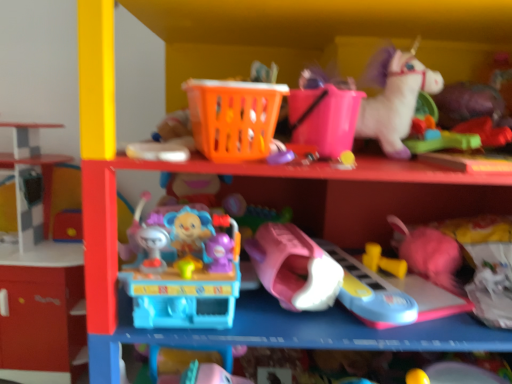
Question: From the image's perspective, is pink plastic toy car at center, placed as the 7th toy when sorted from right to left, located above or below green rubber toy at upper right, which ranks as the 2th toy in right-to-left order?

Choices:
 (A) above
 (B) below

Answer: (B)

Question: From a real-world perspective, is pink plastic toy car at center, the fourth toy in the left-to-right sequence, positioned above or below green rubber toy at upper right, placed as the 9th toy when sorted from left to right?

Choices:
 (A) below
 (B) above

Answer: (A)

Question: Which object is positioned closest to the translucent purple toy at center, placed as the 8th toy when sorted from right to left?

Choices:
 (A) yellow rubber dumbbells at lower center, the 3th toy positioned from the right
 (B) pink plastic bucket at upper center, which is counted as the 5th toy, starting from the left
 (C) pink plastic toy car at center, the fourth toy in the left-to-right sequence
 (D) orange plastic basket at upper center, which is the 2th toy from left to right
 (E) smooth plastic shelf at left

Answer: (D)

Question: Based on their relative distances, which object is farther from the orange plastic basket at upper center, which is the 2th toy from left to right?

Choices:
 (A) translucent purple toy at center, placed as the 8th toy when sorted from right to left
 (B) yellow rubber dumbbells at lower center, acting as the eighth toy starting from the left
 (C) rubberized green toy at upper right, which is the 10th toy in left-to-right order
 (D) smooth plastic shelf at left
 (E) translucent plastic toy at center, the 1th toy when ordered from left to right

Answer: (D)